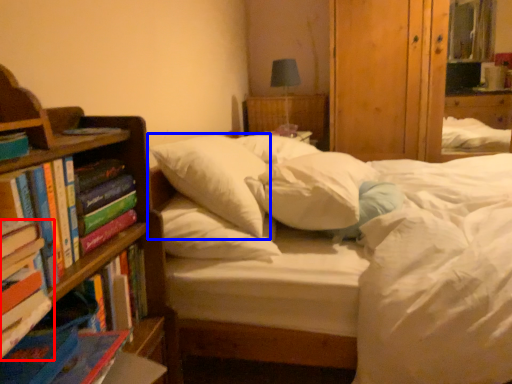
Question: Which object is closer to the camera taking this photo, book (highlighted by a red box) or pillow (highlighted by a blue box)?

Choices:
 (A) book
 (B) pillow

Answer: (A)